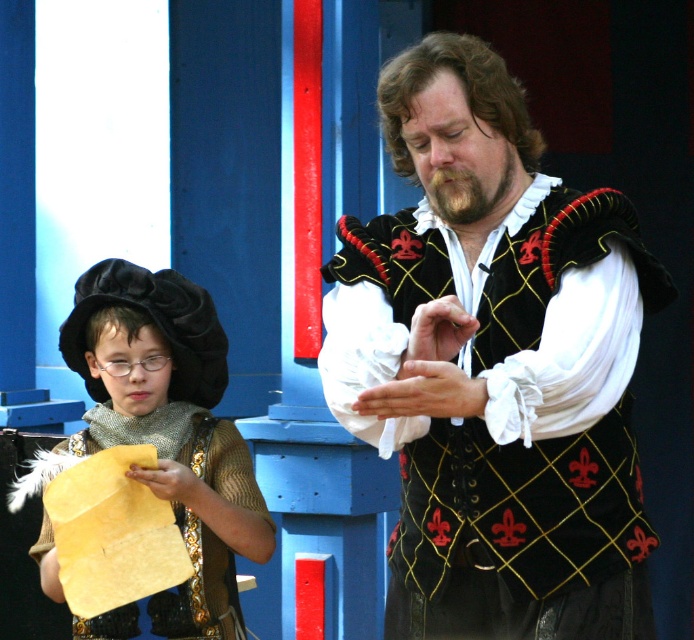
Is the position of black velvet vest at center less distant than that of matte gold paper at left?

That is True.

Is black velvet vest at center further to camera compared to matte gold paper at left?

No, black velvet vest at center is in front of matte gold paper at left.

Between point (509, 253) and point (212, 433), which one is positioned behind?

Positioned behind is point (212, 433).

The height and width of the screenshot is (640, 694). In order to click on black velvet vest at center in this screenshot , I will do `click(496, 365)`.